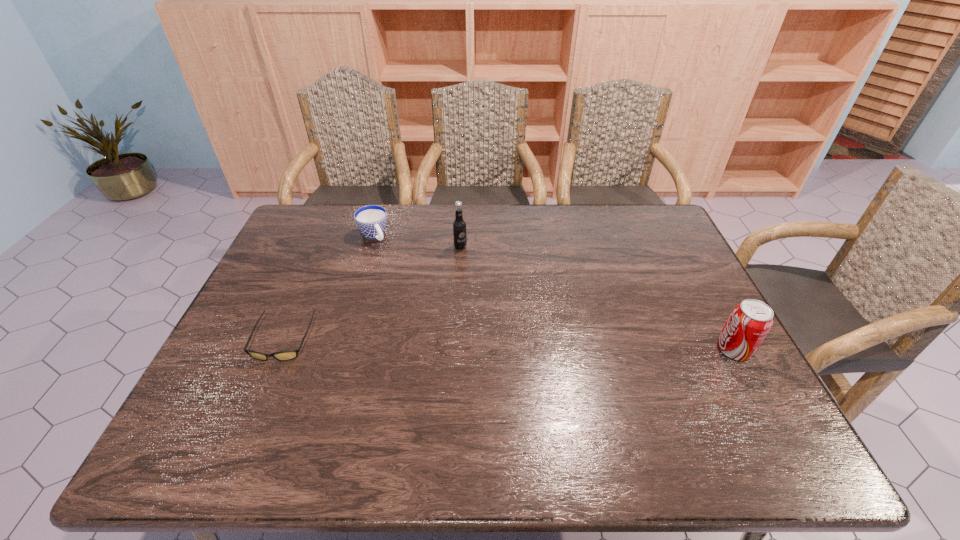
This screenshot has width=960, height=540. I want to click on free space on the desktop that is between the shortest object and the soda and is positioned on the side of the second shortest object with the handle, so click(x=455, y=343).

The width and height of the screenshot is (960, 540). Identify the location of free space on the desktop that is between the leftmost object and the rightmost object and is positioned on the label of the third object from left to right. (553, 346).